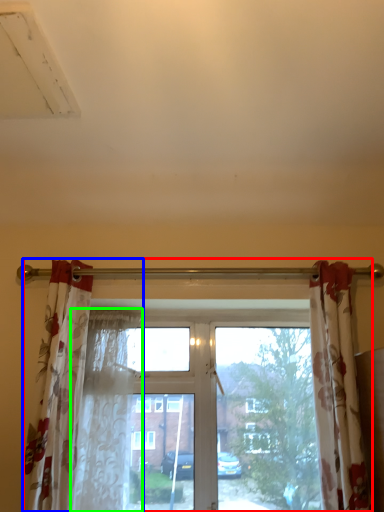
Question: Which is nearer to the window (highlighted by a red box)? curtain (highlighted by a blue box) or shower curtain (highlighted by a green box).

Choices:
 (A) curtain
 (B) shower curtain

Answer: (B)